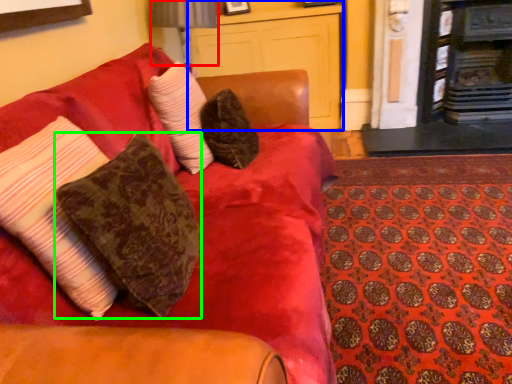
Question: Based on their relative distances, which object is nearer to table lamp (highlighted by a red box)? Choose from dresser (highlighted by a blue box) and pillow (highlighted by a green box).

Choices:
 (A) dresser
 (B) pillow

Answer: (A)